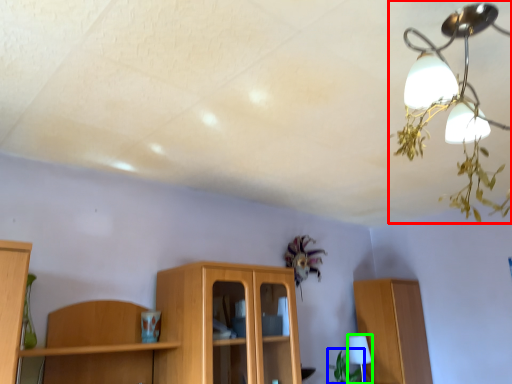
Question: Estimate the real-world distances between objects in this image. Which object is closer to lamp (highlighted by a red box), plant (highlighted by a blue box) or table lamp (highlighted by a green box)?

Choices:
 (A) plant
 (B) table lamp

Answer: (B)